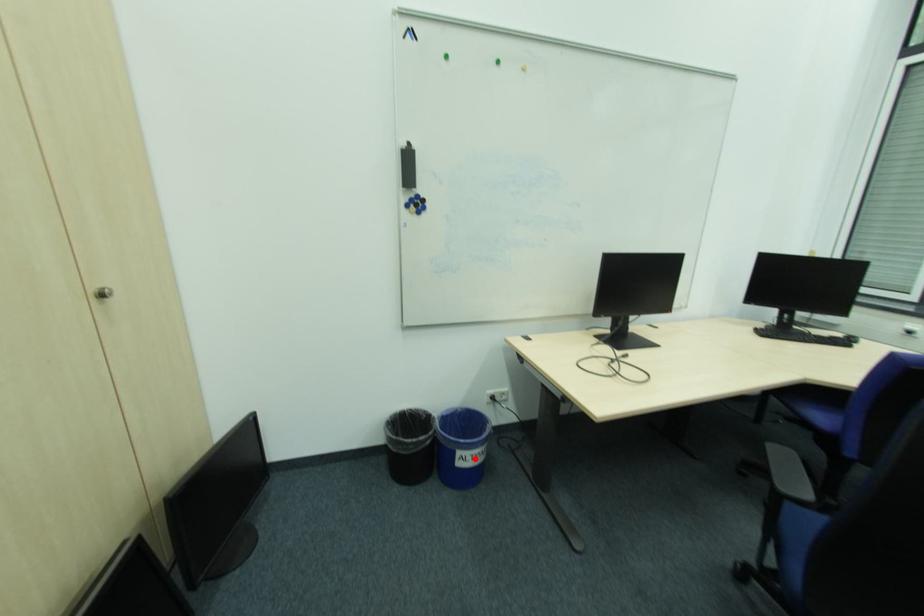
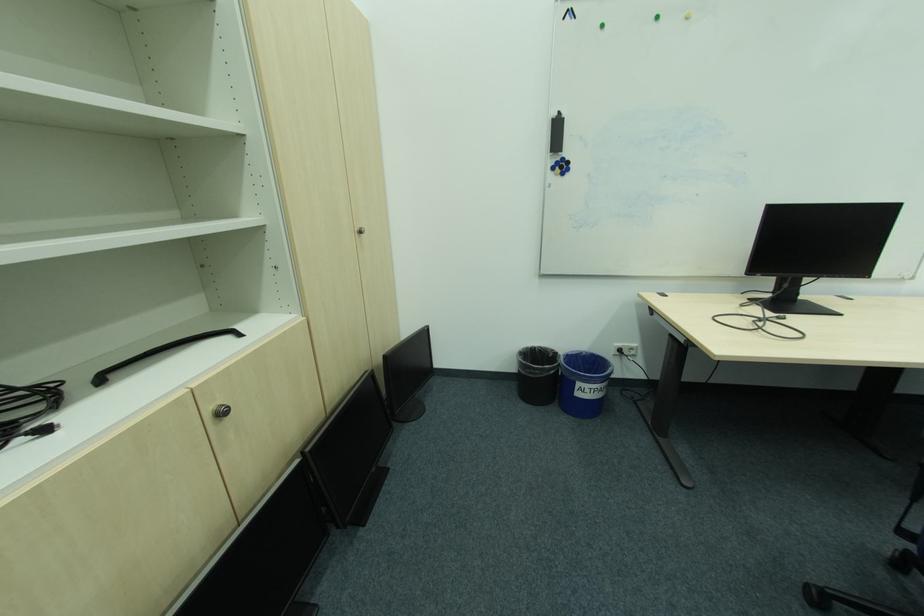
Question: I am providing you with two images of the same scene from different viewpoints. Given a red point in image1, look at the same physical point in image2. Is it:

Choices:
 (A) Closer to the viewpoint
 (B) Farther from the viewpoint

Answer: (A)